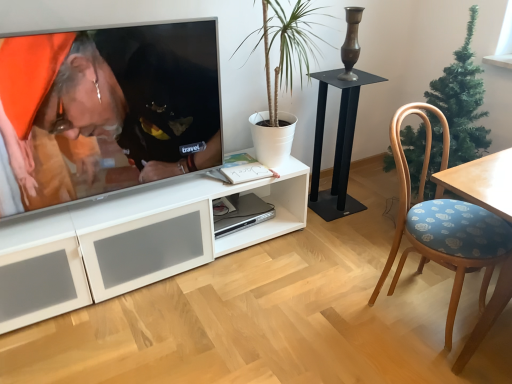
Find the location of a particular element. The image size is (512, 384). free area in between sleek silver computer at center and wooden chair with blue floral cushion at right is located at coordinates (319, 266).